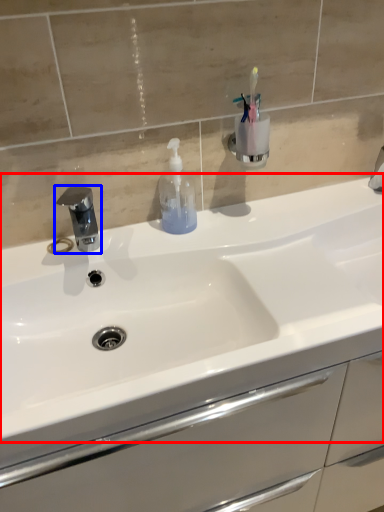
Question: Which object is further to the camera taking this photo, sink (highlighted by a red box) or tap (highlighted by a blue box)?

Choices:
 (A) sink
 (B) tap

Answer: (B)